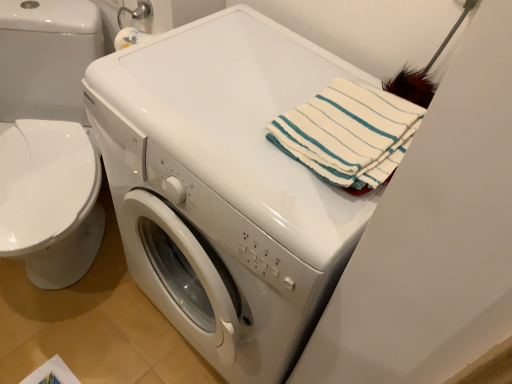
The height and width of the screenshot is (384, 512). What do you see at coordinates (46, 58) in the screenshot? I see `white glossy washer at left` at bounding box center [46, 58].

What do you see at coordinates (225, 187) in the screenshot?
I see `white glossy washing machine at center` at bounding box center [225, 187].

The width and height of the screenshot is (512, 384). What are the coordinates of `white glossy washer at left` in the screenshot? It's located at (46, 58).

Is the depth of white glossy washing machine at center greater than that of white striped towel at upper right?

No, it is not.

How many degrees apart are the facing directions of white glossy washing machine at center and white striped towel at upper right?

The facing directions of white glossy washing machine at center and white striped towel at upper right are 0.000124 degrees apart.

The image size is (512, 384). What are the coordinates of `washing machine in front of the white striped towel at upper right` in the screenshot? It's located at (225, 187).

Can you confirm if white glossy washing machine at center is wider than white striped towel at upper right?

Indeed, white glossy washing machine at center has a greater width compared to white striped towel at upper right.

Considering the sizes of objects white glossy washer at left and white glossy washing machine at center in the image provided, who is smaller, white glossy washer at left or white glossy washing machine at center?

white glossy washer at left is smaller.

Locate an element on the screen. washing machine on the right of the white glossy washer at left is located at coordinates (225, 187).

Which is more to the left, white glossy washer at left or white glossy washing machine at center?

Positioned to the left is white glossy washer at left.

Can you confirm if white glossy washer at left is taller than white striped towel at upper right?

Correct, white glossy washer at left is much taller as white striped towel at upper right.

Does point (78, 96) come closer to viewer compared to point (350, 116)?

No, it is not.

Considering the positions of objects white glossy washer at left and white striped towel at upper right in the image provided, who is more to the right, white glossy washer at left or white striped towel at upper right?

white striped towel at upper right.

Is white striped towel at upper right further to the viewer compared to white glossy washer at left?

No, white striped towel at upper right is in front of white glossy washer at left.

Could you tell me if white striped towel at upper right is turned towards white glossy washer at left?

No, white striped towel at upper right is not aimed at white glossy washer at left.

Considering the relative positions of white striped towel at upper right and white glossy washer at left in the image provided, is white striped towel at upper right to the left of white glossy washer at left from the viewer's perspective?

In fact, white striped towel at upper right is to the right of white glossy washer at left.

From their relative heights in the image, would you say white striped towel at upper right is taller or shorter than white glossy washer at left?

white striped towel at upper right is shorter than white glossy washer at left.

Which is in front, white striped towel at upper right or white glossy washing machine at center?

white glossy washing machine at center is in front.

From the image's perspective, does white striped towel at upper right appear lower than white glossy washing machine at center?

Actually, white striped towel at upper right appears above white glossy washing machine at center in the image.

In terms of size, does white striped towel at upper right appear bigger or smaller than white glossy washing machine at center?

Considering their sizes, white striped towel at upper right takes up less space than white glossy washing machine at center.

Which object is wider, white glossy washing machine at center or white glossy washer at left?

Wider between the two is white glossy washer at left.

From a real-world perspective, which object rests below the other?

white glossy washer at left is physically lower.

How much distance is there between white glossy washing machine at center and white glossy washer at left?

white glossy washing machine at center and white glossy washer at left are 24.68 inches apart from each other.

Considering the sizes of white glossy washing machine at center and white glossy washer at left in the image, is white glossy washing machine at center taller or shorter than white glossy washer at left?

Clearly, white glossy washing machine at center is taller compared to white glossy washer at left.

Locate an element on the screen. The height and width of the screenshot is (384, 512). beach towel behind the white glossy washing machine at center is located at coordinates (348, 134).

In order to click on washer above the white glossy washing machine at center (from the image's perspective) in this screenshot , I will do `click(46, 58)`.

From the image, which object appears to be nearer to white glossy washer at left, white striped towel at upper right or white glossy washing machine at center?

white glossy washing machine at center.

Considering their positions, is white glossy washing machine at center positioned further to white striped towel at upper right than white glossy washer at left?

white glossy washer at left is positioned further to the anchor white striped towel at upper right.

Based on their spatial positions, is white glossy washer at left or white striped towel at upper right closer to white glossy washing machine at center?

white striped towel at upper right is positioned closer to the anchor white glossy washing machine at center.

From the image, which object appears to be farther from white glossy washer at left, white glossy washing machine at center or white striped towel at upper right?

Among the two, white striped towel at upper right is located further to white glossy washer at left.

When comparing their distances from white striped towel at upper right, does white glossy washer at left or white glossy washing machine at center seem closer?

white glossy washing machine at center is positioned closer to the anchor white striped towel at upper right.

Considering their positions, is white striped towel at upper right positioned closer to white glossy washing machine at center than white glossy washer at left?

white striped towel at upper right is closer to white glossy washing machine at center.

Identify the location of washing machine situated between white glossy washer at left and white striped towel at upper right from left to right. Image resolution: width=512 pixels, height=384 pixels. (225, 187).